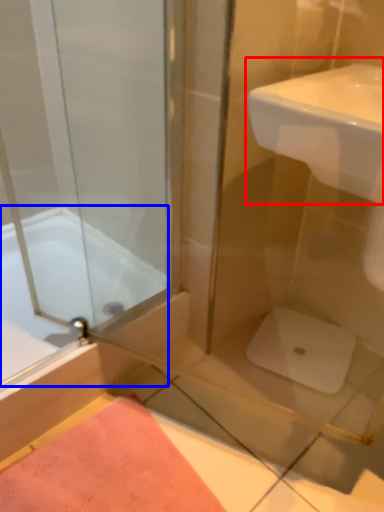
Question: Among these objects, which one is nearest to the camera, sink (highlighted by a red box) or bathtub (highlighted by a blue box)?

Choices:
 (A) sink
 (B) bathtub

Answer: (A)